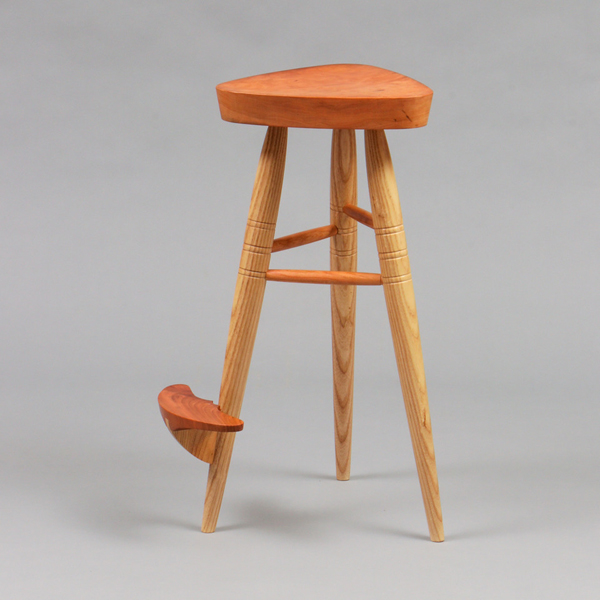
In order to click on seat in this screenshot , I will do `click(339, 103)`.